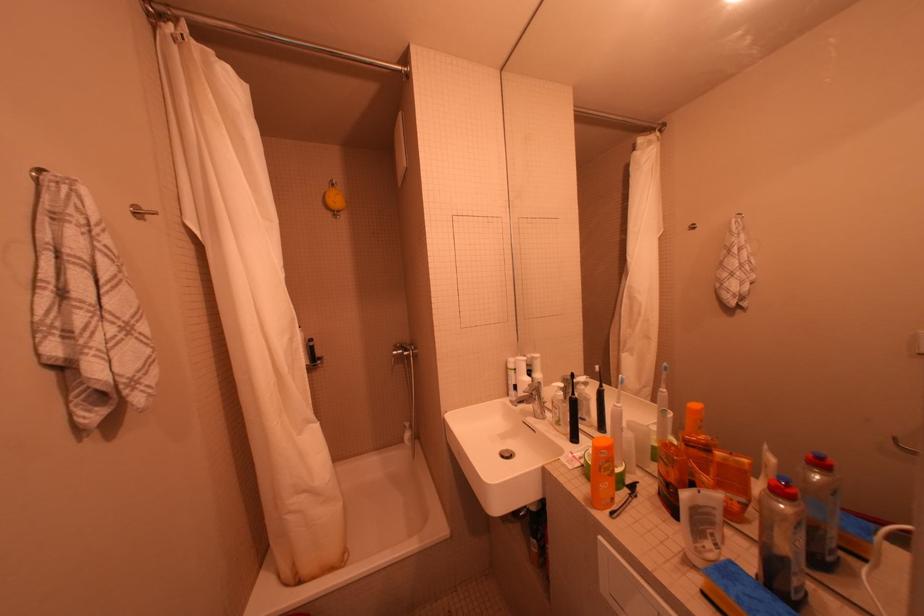
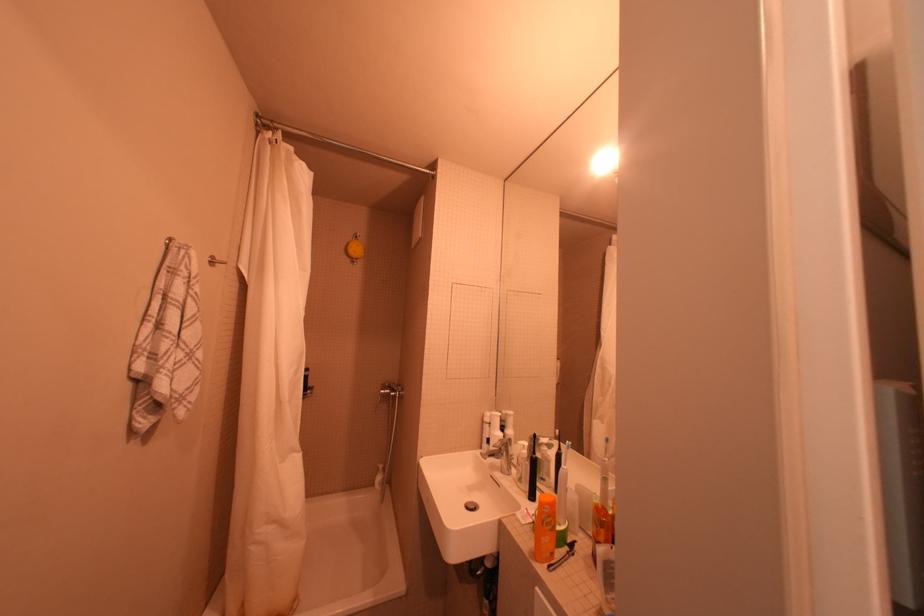
Locate, in the second image, the point that corresponds to point (591, 505) in the first image.

(536, 557)